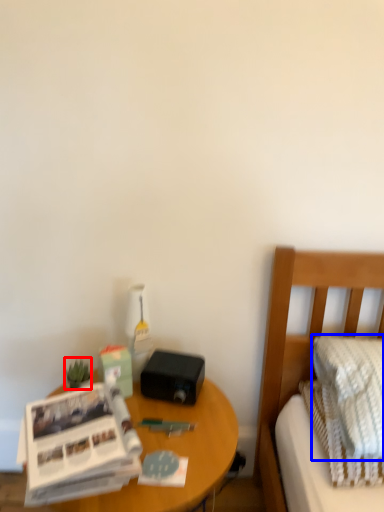
Question: Which of the following is the closest to the observer, plant (highlighted by a red box) or pillow (highlighted by a blue box)?

Choices:
 (A) plant
 (B) pillow

Answer: (B)